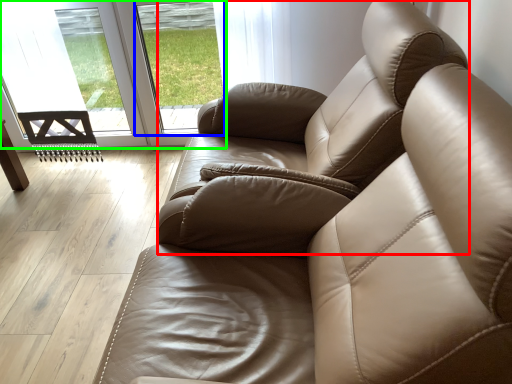
Question: Based on their relative distances, which object is nearer to armchair (highlighted by a red box)? Choose from window (highlighted by a blue box) and glass door (highlighted by a green box).

Choices:
 (A) window
 (B) glass door

Answer: (B)